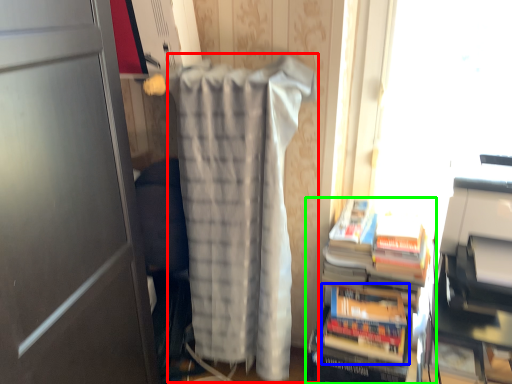
Question: Based on their relative distances, which object is farther from blanket (highlighted by a red box)? Choose from paperback book (highlighted by a blue box) and book (highlighted by a green box).

Choices:
 (A) paperback book
 (B) book

Answer: (A)